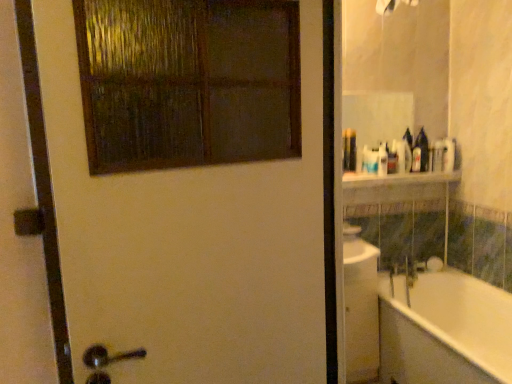
Question: Is white matte door at upper left oriented towards translucent plastic bottle at upper right?

Choices:
 (A) no
 (B) yes

Answer: (A)

Question: Is translucent plastic bottle at upper right a part of white matte door at upper left?

Choices:
 (A) no
 (B) yes

Answer: (A)

Question: Is white matte door at upper left with translucent plastic bottle at upper right?

Choices:
 (A) yes
 (B) no

Answer: (B)

Question: Does white matte door at upper left lie behind translucent plastic bottle at upper right?

Choices:
 (A) yes
 (B) no

Answer: (B)

Question: From a real-world perspective, is white matte door at upper left located higher than translucent plastic bottle at upper right?

Choices:
 (A) yes
 (B) no

Answer: (B)

Question: Is white matte door at upper left closer to camera compared to translucent plastic bottle at upper right?

Choices:
 (A) no
 (B) yes

Answer: (B)

Question: Considering the relative positions of white glossy shelf at upper center and translucent plastic bottle at upper right in the image provided, is white glossy shelf at upper center in front of translucent plastic bottle at upper right?

Choices:
 (A) no
 (B) yes

Answer: (B)

Question: Does white glossy shelf at upper center have a lesser height compared to translucent plastic bottle at upper right?

Choices:
 (A) no
 (B) yes

Answer: (B)

Question: Could you tell me if white glossy shelf at upper center is facing translucent plastic bottle at upper right?

Choices:
 (A) yes
 (B) no

Answer: (B)

Question: Can you confirm if white glossy shelf at upper center is positioned to the left of translucent plastic bottle at upper right?

Choices:
 (A) no
 (B) yes

Answer: (B)

Question: Is white glossy shelf at upper center outside translucent plastic bottle at upper right?

Choices:
 (A) yes
 (B) no

Answer: (A)

Question: Can you confirm if white glossy shelf at upper center is taller than translucent plastic bottle at upper right?

Choices:
 (A) yes
 (B) no

Answer: (B)

Question: Is white glossy bathtub at right turned away from white matte door at upper left?

Choices:
 (A) no
 (B) yes

Answer: (A)